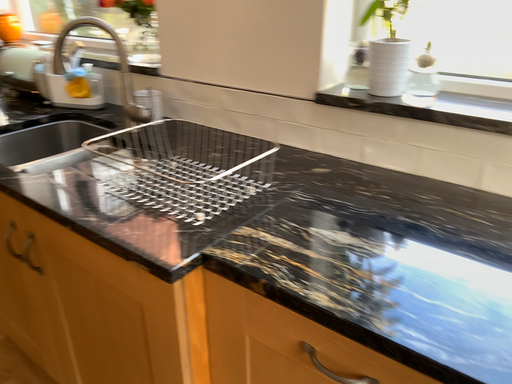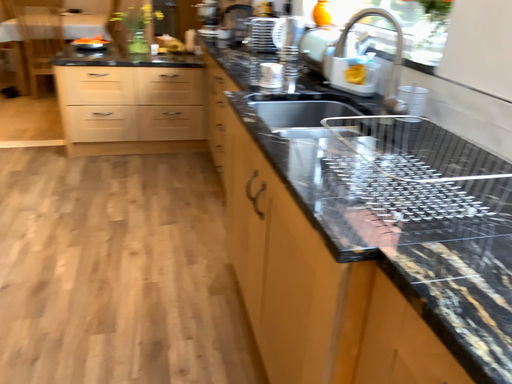
Question: How did the camera likely rotate when shooting the video?

Choices:
 (A) rotated upward
 (B) rotated downward

Answer: (A)